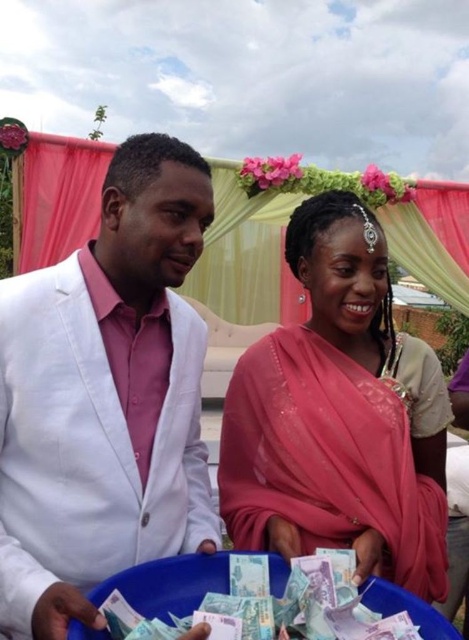
From the picture: Does white matte suit at left have a lesser height compared to pink silk saree at center?

Indeed, white matte suit at left has a lesser height compared to pink silk saree at center.

Is the position of white matte suit at left more distant than that of pink silk saree at center?

No, it is in front of pink silk saree at center.

Is point (114, 410) less distant than point (272, 525)?

Yes, it is.

Locate an element on the screen. Image resolution: width=469 pixels, height=640 pixels. white matte suit at left is located at coordinates (105, 397).

Is white matte suit at left shorter than light blue paper money at lower center?

No.

At what (x,y) coordinates should I click in order to perform the action: click on white matte suit at left. Please return your answer as a coordinate pair (x, y). This screenshot has height=640, width=469. Looking at the image, I should click on (105, 397).

This screenshot has width=469, height=640. Find the location of `white matte suit at left`. white matte suit at left is located at coordinates (105, 397).

Can you confirm if pink silk saree at center is positioned above light blue paper money at lower center?

Yes, pink silk saree at center is above light blue paper money at lower center.

Identify the location of pink silk saree at center. (340, 416).

Find the location of a particular element. The image size is (469, 640). pink silk saree at center is located at coordinates (340, 416).